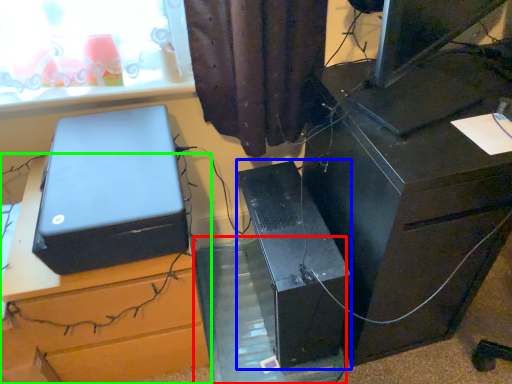
Question: Considering the real-world distances, which object is farthest from glass table (highlighted by a red box)? computer tower (highlighted by a blue box) or furniture (highlighted by a green box)?

Choices:
 (A) computer tower
 (B) furniture

Answer: (B)